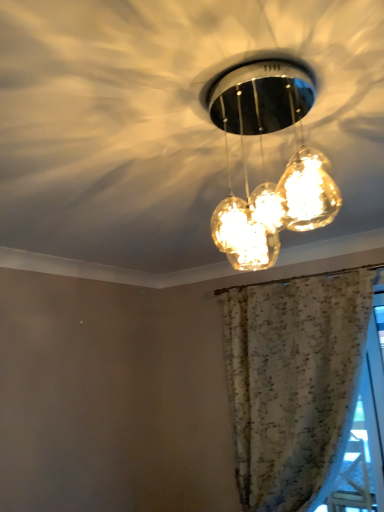
Question: Visually, is floral fabric curtain at upper center positioned to the left or to the right of translucent glass pendant lights at center?

Choices:
 (A) right
 (B) left

Answer: (A)

Question: From the image's perspective, is floral fabric curtain at upper center above or below translucent glass pendant lights at center?

Choices:
 (A) above
 (B) below

Answer: (B)

Question: Is point (324, 287) positioned closer to the camera than point (309, 83)?

Choices:
 (A) farther
 (B) closer

Answer: (A)

Question: From their relative heights in the image, would you say translucent glass pendant lights at center is taller or shorter than floral fabric curtain at upper center?

Choices:
 (A) short
 (B) tall

Answer: (A)

Question: From a real-world perspective, is translucent glass pendant lights at center positioned above or below floral fabric curtain at upper center?

Choices:
 (A) above
 (B) below

Answer: (A)

Question: Considering their positions, is translucent glass pendant lights at center located in front of or behind floral fabric curtain at upper center?

Choices:
 (A) front
 (B) behind

Answer: (A)

Question: From the image's perspective, is translucent glass pendant lights at center located above or below floral fabric curtain at upper center?

Choices:
 (A) below
 (B) above

Answer: (B)